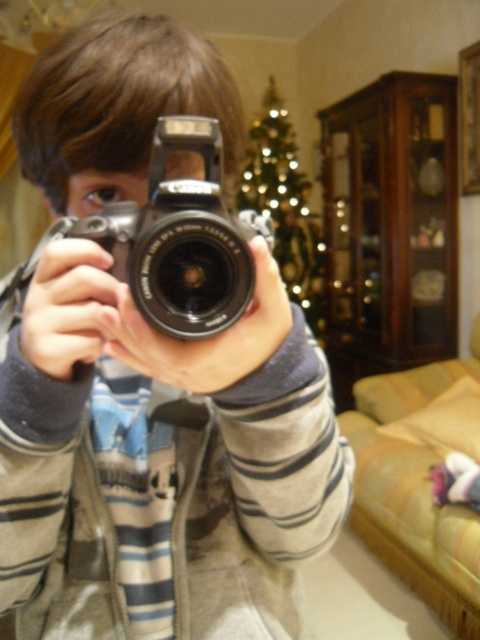
Is point (215, 60) farther from viewer compared to point (320, 289)?

No, it is in front of (320, 289).

Between matte silver camera at center and shiny gold christmas tree at center, which one is positioned higher?

Positioned higher is shiny gold christmas tree at center.

What do you see at coordinates (158, 460) in the screenshot?
I see `matte silver camera at center` at bounding box center [158, 460].

Where is `matte silver camera at center`? The height and width of the screenshot is (640, 480). matte silver camera at center is located at coordinates (158, 460).

Can you confirm if matte silver camera at center is positioned to the right of silver metallic camera at center?

In fact, matte silver camera at center is to the left of silver metallic camera at center.

Who is more forward, (x=120, y=131) or (x=132, y=204)?

Point (x=132, y=204) is in front.

Who is more forward, [100,205] or [153,300]?

Point [153,300]

The height and width of the screenshot is (640, 480). What are the coordinates of `matte silver camera at center` in the screenshot? It's located at (158, 460).

Is point (153, 150) more distant than point (248, 198)?

No, it is not.

Who is more distant from viewer, (92, 216) or (311, 316)?

The point (311, 316) is more distant.

Is point (211, 332) closer to camera compared to point (245, 180)?

Yes.

At what (x,y) coordinates should I click in order to perform the action: click on silver metallic camera at center. Please return your answer as a coordinate pair (x, y). The image size is (480, 640). Looking at the image, I should click on (180, 237).